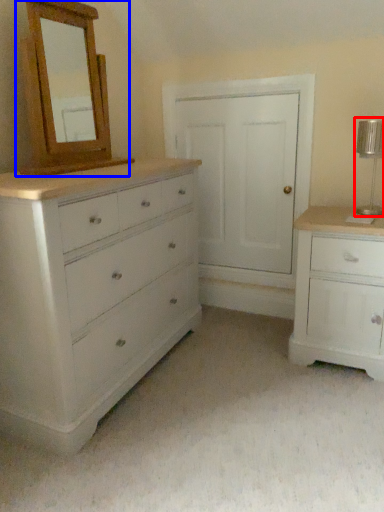
Question: Which object appears closest to the camera in this image, table lamp (highlighted by a red box) or medicine cabinet (highlighted by a blue box)?

Choices:
 (A) table lamp
 (B) medicine cabinet

Answer: (B)